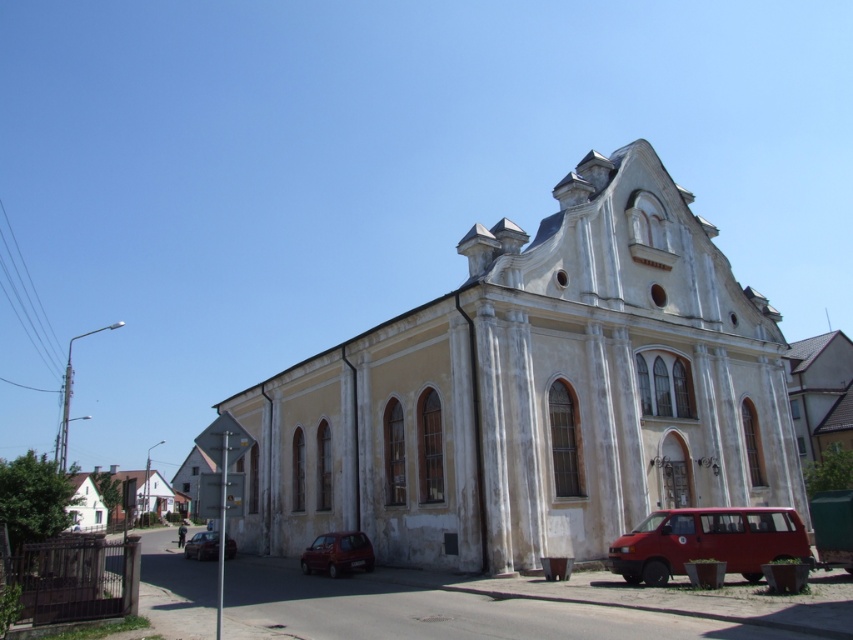
Who is more forward, (625, 577) or (363, 538)?

Point (625, 577)

The width and height of the screenshot is (853, 640). I want to click on matte red van at lower right, so click(708, 541).

Is point (753, 536) in front of point (363, 563)?

Yes, point (753, 536) is in front of point (363, 563).

Identify the location of matte red van at lower right. The height and width of the screenshot is (640, 853). (708, 541).

Does matte red van at lower right have a greater height compared to matte red car at lower left?

In fact, matte red van at lower right may be shorter than matte red car at lower left.

Between matte red van at lower right and matte red car at lower left, which one has less height?

Standing shorter between the two is matte red van at lower right.

At what (x,y) coordinates should I click in order to perform the action: click on matte red van at lower right. Please return your answer as a coordinate pair (x, y). This screenshot has height=640, width=853. Looking at the image, I should click on (708, 541).

Is matte red car at lower center positioned in front of matte red car at lower left?

That is True.

Which of these two, matte red car at lower center or matte red car at lower left, stands taller?

Standing taller between the two is matte red car at lower left.

Where is `matte red car at lower center`? This screenshot has width=853, height=640. matte red car at lower center is located at coordinates (337, 554).

Identify the location of matte red car at lower center. The image size is (853, 640). (337, 554).